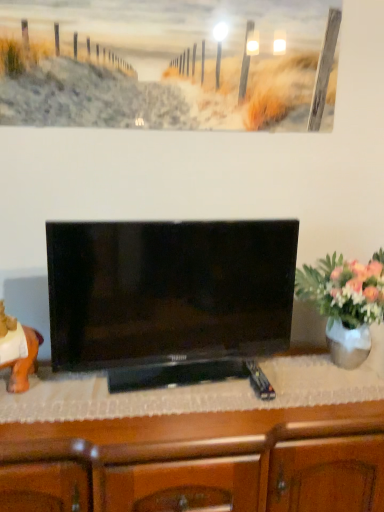
Where is `vacant space to the right of orange matte statue at left`? This screenshot has height=512, width=384. vacant space to the right of orange matte statue at left is located at coordinates (72, 392).